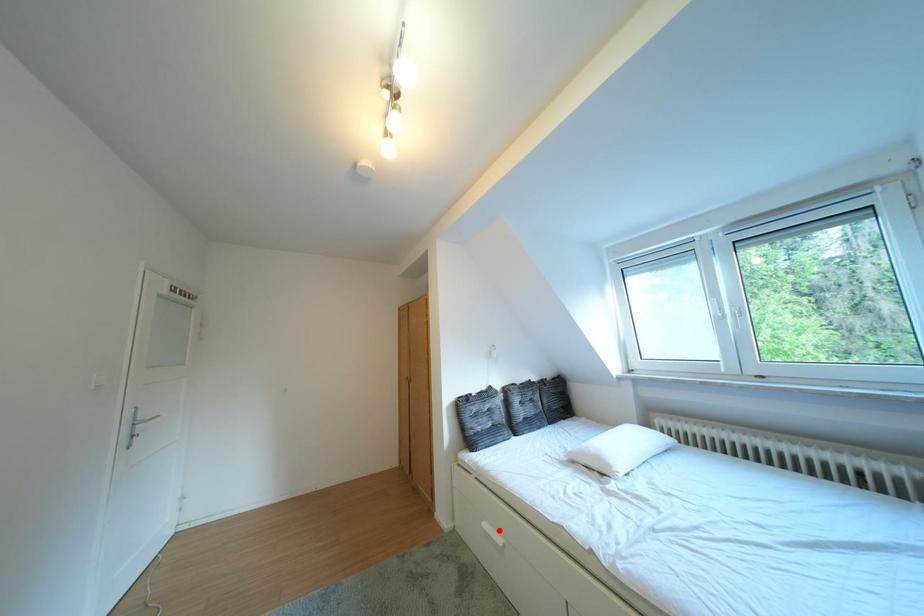
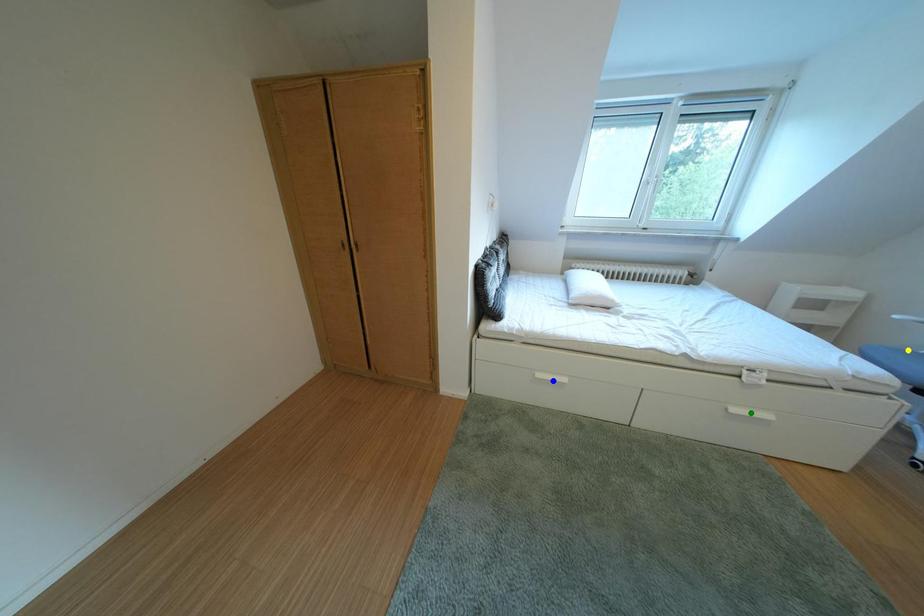
Question: I am providing you with two images of the same scene from different viewpoints. A red point is marked on the first image. You are given multiple points on the second image. Which point in image 2 is actually the same real-world point as the red point in image 1?

Choices:
 (A) blue point
 (B) yellow point
 (C) green point

Answer: (A)